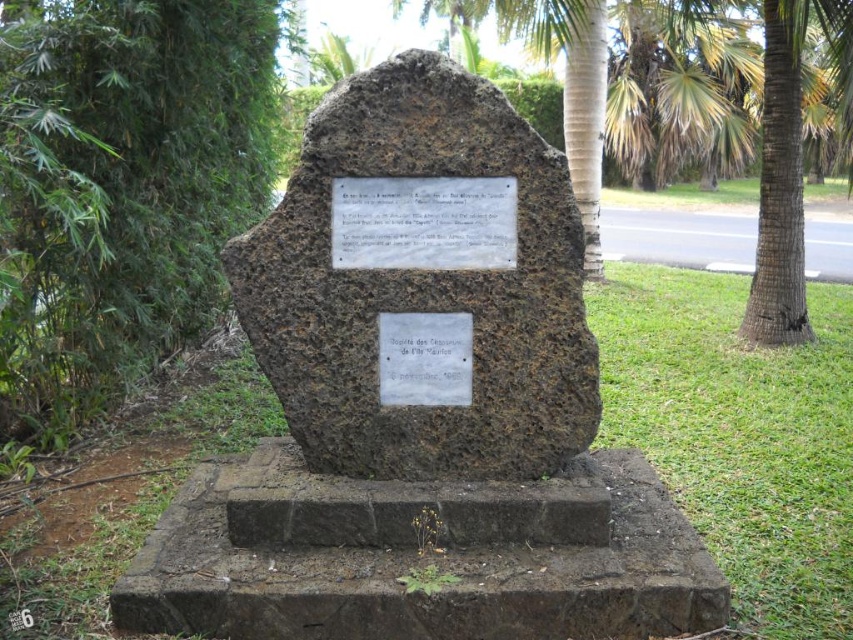
Question: Which object is the farthest from the white metal plaque at center?

Choices:
 (A) brown stone monument at center
 (B) white stone plaque at center
 (C) green leafy tree at left
 (D) brown rough stone monument at center

Answer: (C)

Question: Is brown stone monument at center positioned in front of brown rough stone monument at center?

Choices:
 (A) yes
 (B) no

Answer: (A)

Question: Where is brown rough stone monument at center located in relation to white metal plaque at center in the image?

Choices:
 (A) right
 (B) left

Answer: (A)

Question: Which of the following is the farthest from the observer?

Choices:
 (A) white metal plaque at center
 (B) brown stone monument at center

Answer: (A)

Question: Which point appears closest to the camera in this image?

Choices:
 (A) (538, 353)
 (B) (428, 260)
 (C) (460, 344)
 (D) (323, 328)

Answer: (B)

Question: Does brown stone monument at center have a smaller size compared to white metal plaque at center?

Choices:
 (A) no
 (B) yes

Answer: (A)